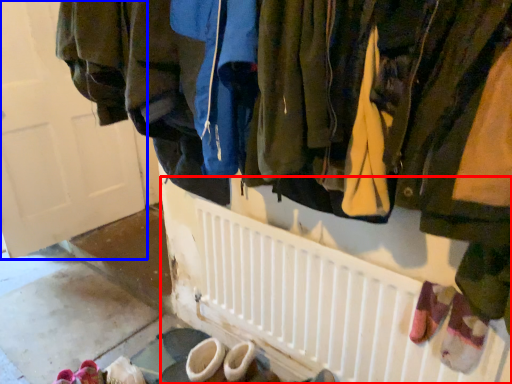
Question: Which point is further to the camera, radiator (highlighted by a red box) or door (highlighted by a blue box)?

Choices:
 (A) radiator
 (B) door

Answer: (B)